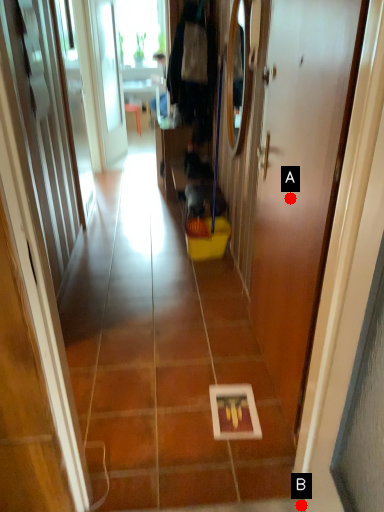
Question: Two points are circled on the image, labeled by A and B beside each circle. Which point is closer to the camera taking this photo?

Choices:
 (A) A is closer
 (B) B is closer

Answer: (B)